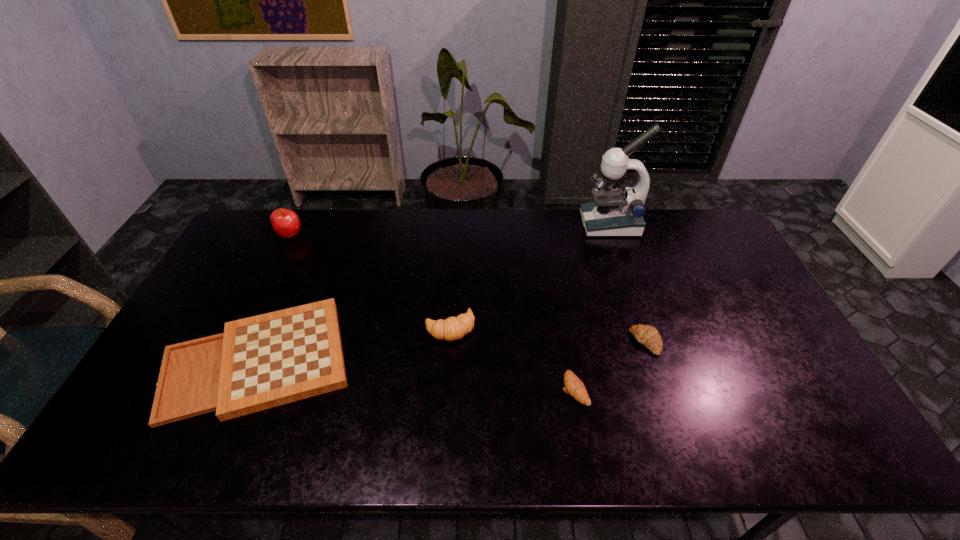
Locate which object ranks third in proximity to the gameboard. Please provide its 2D coordinates. Your answer should be formatted as a tuple, i.e. [(x, y)], where the tuple contains the x and y coordinates of a point satisfying the conditions above.

[(574, 386)]

Identify which object is the fifth nearest to the rightmost crescent roll. Please provide its 2D coordinates. Your answer should be formatted as a tuple, i.e. [(x, y)], where the tuple contains the x and y coordinates of a point satisfying the conditions above.

[(286, 223)]

Select which crescent roll appears as the third closest to the gameboard. Please provide its 2D coordinates. Your answer should be formatted as a tuple, i.e. [(x, y)], where the tuple contains the x and y coordinates of a point satisfying the conditions above.

[(647, 335)]

Locate which crescent roll is the third closest to the microscope. Please provide its 2D coordinates. Your answer should be formatted as a tuple, i.e. [(x, y)], where the tuple contains the x and y coordinates of a point satisfying the conditions above.

[(574, 386)]

In order to click on free spot that satisfies the following two spatial constraints: 1. on the front side of the tallest crescent roll; 2. on the left side of the rightmost crescent roll in this screenshot , I will do `click(449, 342)`.

Find the location of a particular element. vacant space that satisfies the following two spatial constraints: 1. at the eyepiece of the microscope; 2. on the front side of the leftmost crescent roll is located at coordinates click(x=646, y=328).

You are a GUI agent. You are given a task and a screenshot of the screen. Output one action in this format:
    pyautogui.click(x=<x>, y=<y>)
    Task: Click on the vacant area in the image that satisfies the following two spatial constraints: 1. on the front side of the shortest crescent roll; 2. on the right side of the apple
    This screenshot has height=540, width=960.
    Given the screenshot: What is the action you would take?
    pyautogui.click(x=215, y=389)